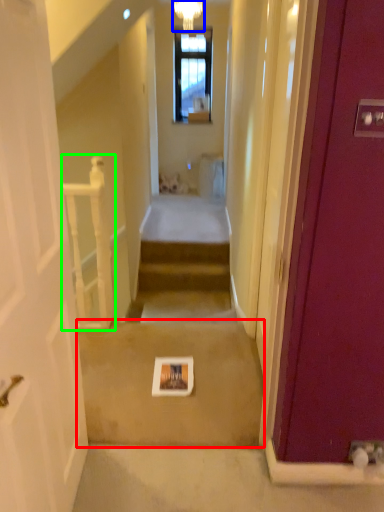
Question: Which object is the farthest from path (highlighted by a red box)? Choose among these: light fixture (highlighted by a blue box) or balustrade (highlighted by a green box).

Choices:
 (A) light fixture
 (B) balustrade

Answer: (A)